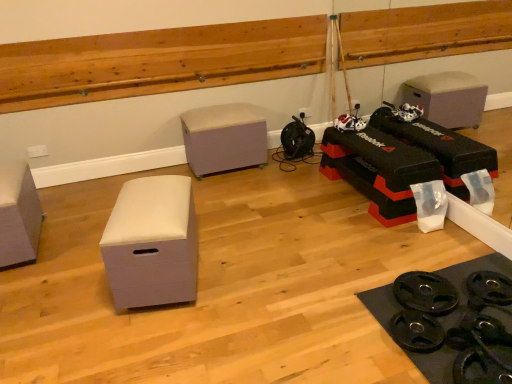
Where is `free point above white matte storage box at center-left, which is the 1th furniture from front to back (from a real-world perspective)`? The image size is (512, 384). free point above white matte storage box at center-left, which is the 1th furniture from front to back (from a real-world perspective) is located at coordinates (150, 192).